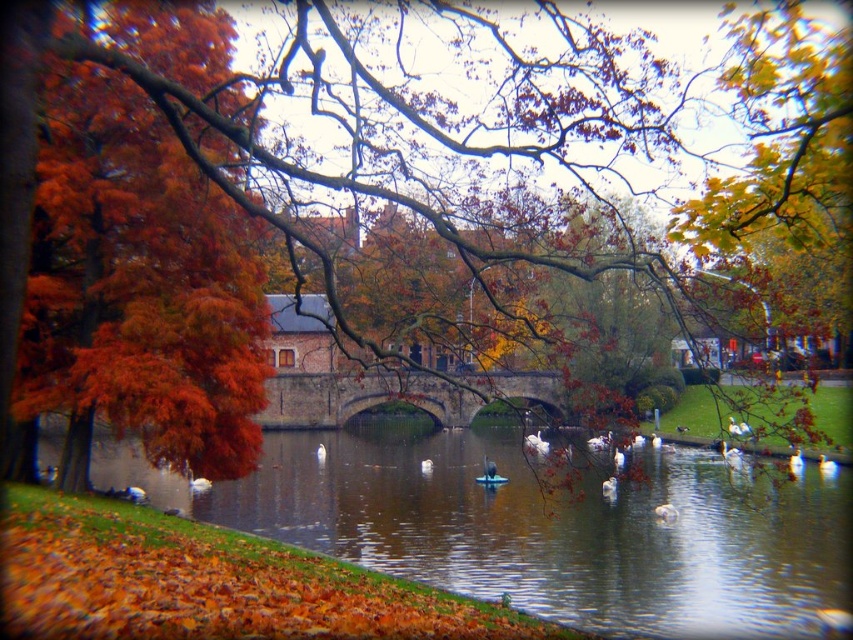
You are standing on the grassy bank and want to cross the brown stone bridge at center to reach the other side. However, you notice the brown reflective water at center beneath the bridge. Is the water directly under the bridge, or is it beside it?

The brown reflective water at center is located below brown stone bridge at center, so the water is directly under the bridge.